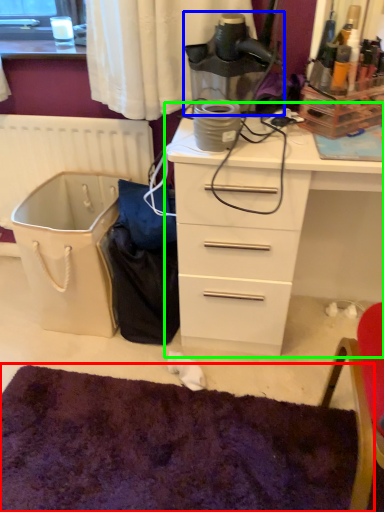
Question: Estimate the real-world distances between objects in this image. Which object is closer to mat (highlighted by a red box), appliance (highlighted by a blue box) or chest of drawers (highlighted by a green box)?

Choices:
 (A) appliance
 (B) chest of drawers

Answer: (B)